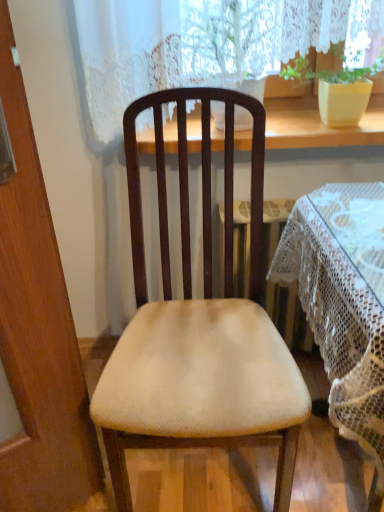
Question: Could you tell me if wooden at upper center is facing white lace tablecloth at center?

Choices:
 (A) yes
 (B) no

Answer: (B)

Question: Does wooden at upper center have a lesser height compared to white lace tablecloth at center?

Choices:
 (A) yes
 (B) no

Answer: (A)

Question: Can you confirm if wooden at upper center is wider than white lace tablecloth at center?

Choices:
 (A) yes
 (B) no

Answer: (B)

Question: Does wooden at upper center come in front of white lace tablecloth at center?

Choices:
 (A) yes
 (B) no

Answer: (B)

Question: Is wooden at upper center oriented away from white lace tablecloth at center?

Choices:
 (A) no
 (B) yes

Answer: (A)

Question: From the image's perspective, is white lace tablecloth at center above or below beige fabric chair at center?

Choices:
 (A) below
 (B) above

Answer: (A)

Question: Considering the relative positions of white lace tablecloth at center and beige fabric chair at center in the image provided, is white lace tablecloth at center to the left or to the right of beige fabric chair at center?

Choices:
 (A) right
 (B) left

Answer: (A)

Question: Is white lace tablecloth at center taller or shorter than beige fabric chair at center?

Choices:
 (A) short
 (B) tall

Answer: (A)

Question: Looking at the image, does white lace tablecloth at center seem bigger or smaller compared to beige fabric chair at center?

Choices:
 (A) small
 (B) big

Answer: (B)

Question: Does point (367, 198) appear closer or farther from the camera than point (292, 103)?

Choices:
 (A) farther
 (B) closer

Answer: (B)

Question: Is white lace tablecloth at center wider or thinner than wooden at upper center?

Choices:
 (A) wide
 (B) thin

Answer: (A)

Question: Based on their sizes in the image, would you say white lace tablecloth at center is bigger or smaller than wooden at upper center?

Choices:
 (A) small
 (B) big

Answer: (B)

Question: Is white lace tablecloth at center inside the boundaries of wooden at upper center, or outside?

Choices:
 (A) inside
 (B) outside

Answer: (B)

Question: Looking at their shapes, would you say beige fabric chair at center is wider or thinner than matte yellow pot at upper right?

Choices:
 (A) thin
 (B) wide

Answer: (B)

Question: From a real-world perspective, is beige fabric chair at center above or below matte yellow pot at upper right?

Choices:
 (A) above
 (B) below

Answer: (B)